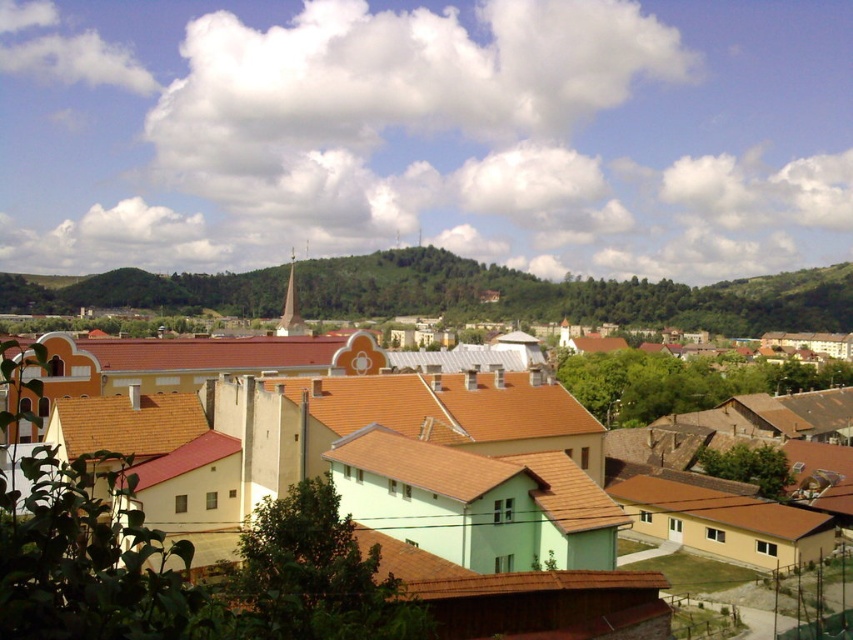
Is green leafy hillside at center in front of brown tile roof at center?

No.

Does green leafy hillside at center have a smaller size compared to brown tile roof at center?

No, green leafy hillside at center is not smaller than brown tile roof at center.

Identify the location of green leafy hillside at center. (572, 294).

Can you confirm if yellow matte building at center is smaller than green leafy hillside at center?

Correct, yellow matte building at center occupies less space than green leafy hillside at center.

Does yellow matte building at center appear over green leafy hillside at center?

Incorrect, yellow matte building at center is not positioned above green leafy hillside at center.

Who is more forward, (471, 499) or (364, 316)?

Point (471, 499) is in front.

Locate an element on the screen. The height and width of the screenshot is (640, 853). yellow matte building at center is located at coordinates (494, 536).

Does yellow matte building at center come behind brown tile roof at center?

That is False.

Is yellow matte building at center thinner than brown tile roof at center?

No.

At what (x,y) coordinates should I click in order to perform the action: click on yellow matte building at center. Please return your answer as a coordinate pair (x, y). This screenshot has width=853, height=640. Looking at the image, I should click on (494, 536).